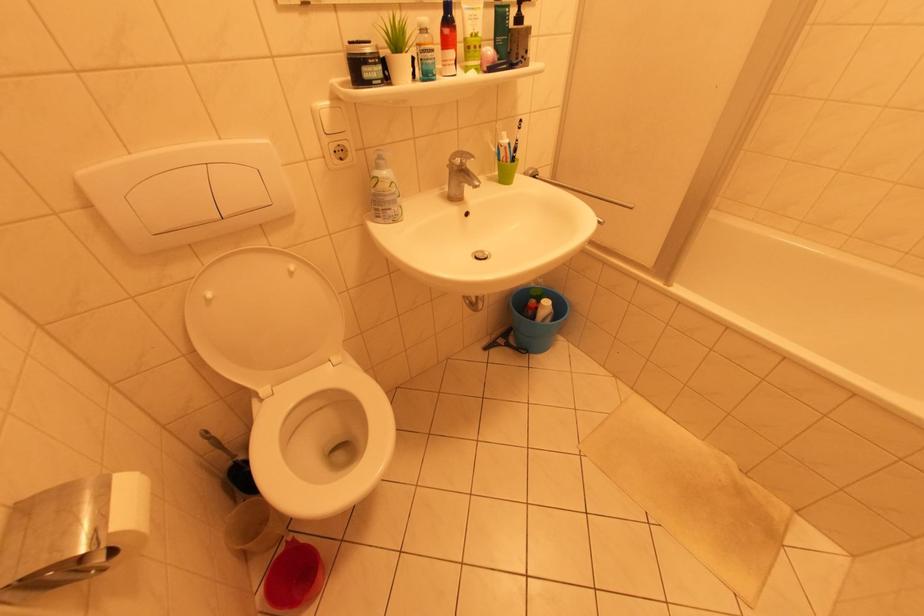
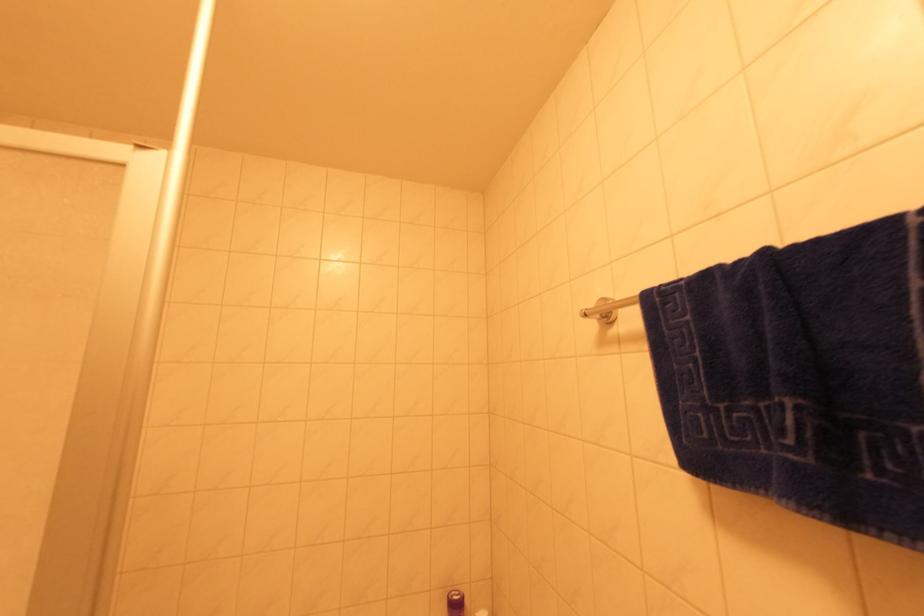
The first image is from the beginning of the video and the second image is from the end. How did the camera likely rotate when shooting the video?

The camera rotated toward right-up.